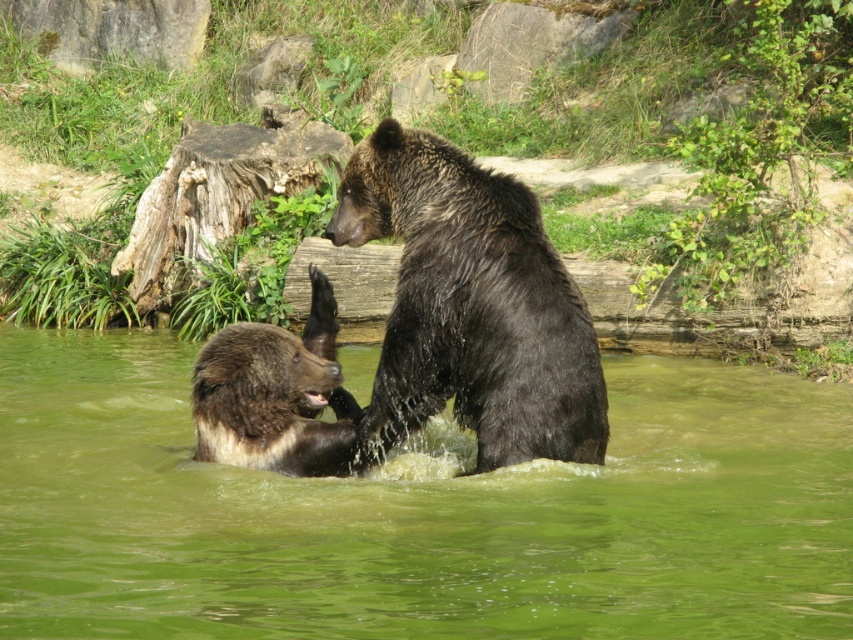
The height and width of the screenshot is (640, 853). What do you see at coordinates (419, 513) in the screenshot?
I see `green water at center` at bounding box center [419, 513].

Locate an element on the screen. This screenshot has width=853, height=640. green water at center is located at coordinates (419, 513).

Is point (476, 417) closer to camera compared to point (320, 328)?

Yes, point (476, 417) is closer to viewer.

Who is shorter, shiny dark fur bear at center or brown furry bear at center?

brown furry bear at center is shorter.

Identify the location of shiny dark fur bear at center. (469, 307).

At what (x,y) coordinates should I click in order to perform the action: click on shiny dark fur bear at center. Please return your answer as a coordinate pair (x, y). The image size is (853, 640). Looking at the image, I should click on (469, 307).

Does green water at center have a greater width compared to brown furry bear at center?

Correct, the width of green water at center exceeds that of brown furry bear at center.

Is green water at center positioned behind brown furry bear at center?

No, green water at center is closer to the viewer.

Identify the location of green water at center. (419, 513).